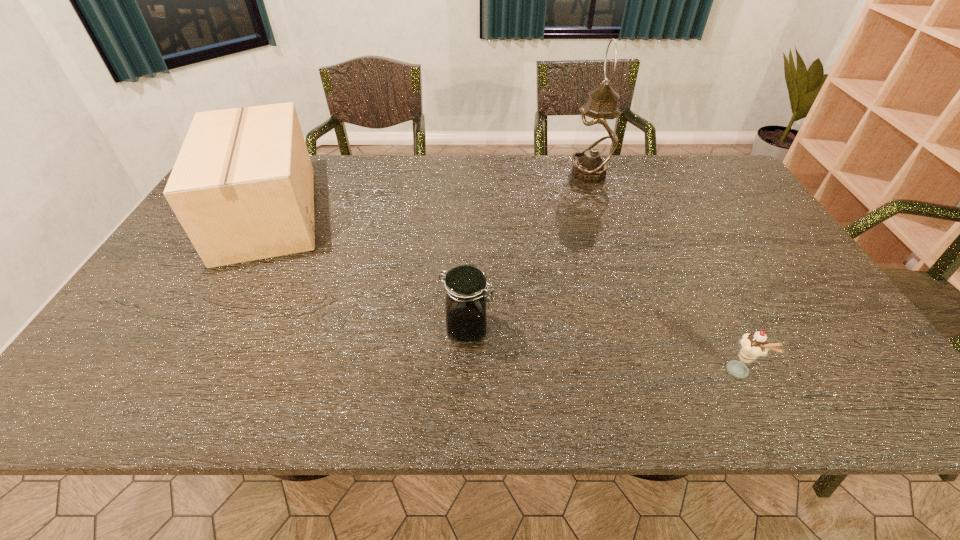
Where is `vacant space located on the lid of the jar`? The image size is (960, 540). vacant space located on the lid of the jar is located at coordinates (615, 328).

Find the location of a particular element. The width and height of the screenshot is (960, 540). free space located on the left of the nearest object is located at coordinates (574, 372).

I want to click on oil lamp that is at the far edge, so click(596, 139).

You are a GUI agent. You are given a task and a screenshot of the screen. Output one action in this format:
    pyautogui.click(x=<x>, y=<y>)
    Task: Click on the box situated at the far edge
    
    Given the screenshot: What is the action you would take?
    pyautogui.click(x=242, y=187)

Where is `object at the near edge`? The width and height of the screenshot is (960, 540). object at the near edge is located at coordinates (755, 345).

Where is `object that is at the left edge`? This screenshot has width=960, height=540. object that is at the left edge is located at coordinates click(242, 187).

I want to click on object that is at the far left corner, so click(x=242, y=187).

In the image, there is a desktop. Identify the location of vacant space at the far edge. The height and width of the screenshot is (540, 960). (607, 173).

In order to click on vacant region at the near edge of the desktop in this screenshot , I will do `click(236, 404)`.

In the image, there is a desktop. Where is `vacant space at the right edge`? This screenshot has width=960, height=540. vacant space at the right edge is located at coordinates (756, 299).